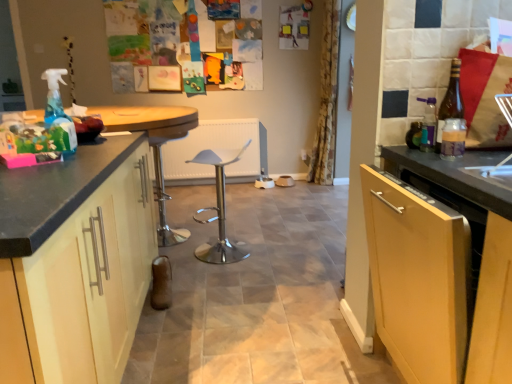
Question: Is brown glass bottle at right, which is counted as the second bottle, starting from the front, facing towards yellow floral fabric curtain at center?

Choices:
 (A) no
 (B) yes

Answer: (A)

Question: Is brown glass bottle at right, the 1th bottle in the back-to-front sequence, not inside yellow floral fabric curtain at center?

Choices:
 (A) no
 (B) yes

Answer: (B)

Question: Does brown glass bottle at right, which is counted as the second bottle, starting from the front, contain yellow floral fabric curtain at center?

Choices:
 (A) no
 (B) yes

Answer: (A)

Question: Considering the relative positions of brown glass bottle at right, which is counted as the second bottle, starting from the front, and yellow floral fabric curtain at center in the image provided, is brown glass bottle at right, which is counted as the second bottle, starting from the front, to the right of yellow floral fabric curtain at center from the viewer's perspective?

Choices:
 (A) no
 (B) yes

Answer: (A)

Question: Does brown glass bottle at right, which is counted as the second bottle, starting from the front, have a larger size compared to yellow floral fabric curtain at center?

Choices:
 (A) no
 (B) yes

Answer: (A)

Question: Looking at their shapes, would you say brown glass bottle at right, the 1th bottle in the back-to-front sequence, is wider or thinner than black granite countertop at left?

Choices:
 (A) wide
 (B) thin

Answer: (B)

Question: From a real-world perspective, relative to black granite countertop at left, is brown glass bottle at right, which is counted as the second bottle, starting from the front, vertically above or below?

Choices:
 (A) above
 (B) below

Answer: (A)

Question: Does point (446, 102) appear closer or farther from the camera than point (178, 135)?

Choices:
 (A) closer
 (B) farther

Answer: (A)

Question: Is brown glass bottle at right, the 1th bottle in the back-to-front sequence, situated inside black granite countertop at left or outside?

Choices:
 (A) outside
 (B) inside

Answer: (A)

Question: In terms of width, does yellow floral fabric curtain at center look wider or thinner when compared to brown glass bottle at right, which is counted as the second bottle, starting from the front?

Choices:
 (A) wide
 (B) thin

Answer: (A)

Question: Is point (322, 87) closer or farther from the camera than point (454, 82)?

Choices:
 (A) closer
 (B) farther

Answer: (B)

Question: Which is correct: yellow floral fabric curtain at center is inside brown glass bottle at right, the 1th bottle in the back-to-front sequence, or outside of it?

Choices:
 (A) inside
 (B) outside

Answer: (B)

Question: Visually, is yellow floral fabric curtain at center positioned to the left or to the right of brown glass bottle at right, which is counted as the second bottle, starting from the front?

Choices:
 (A) right
 (B) left

Answer: (A)

Question: Is polished silver bar stool at center, positioned as the 1th bar stool in right-to-left order, inside the boundaries of matte black cabinet at left, or outside?

Choices:
 (A) inside
 (B) outside

Answer: (B)

Question: Based on their positions, is polished silver bar stool at center, acting as the 2th bar stool starting from the left, located to the left or right of matte black cabinet at left?

Choices:
 (A) right
 (B) left

Answer: (A)